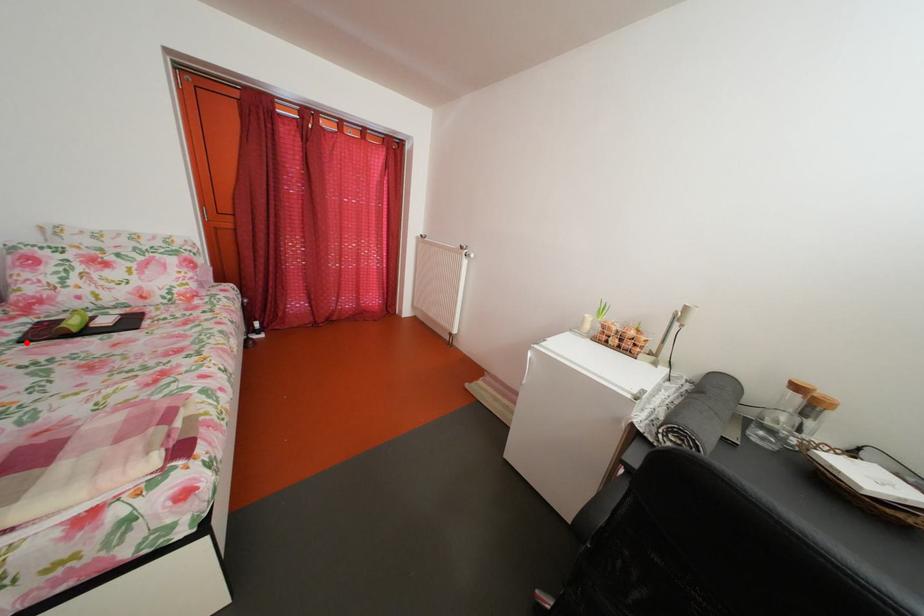
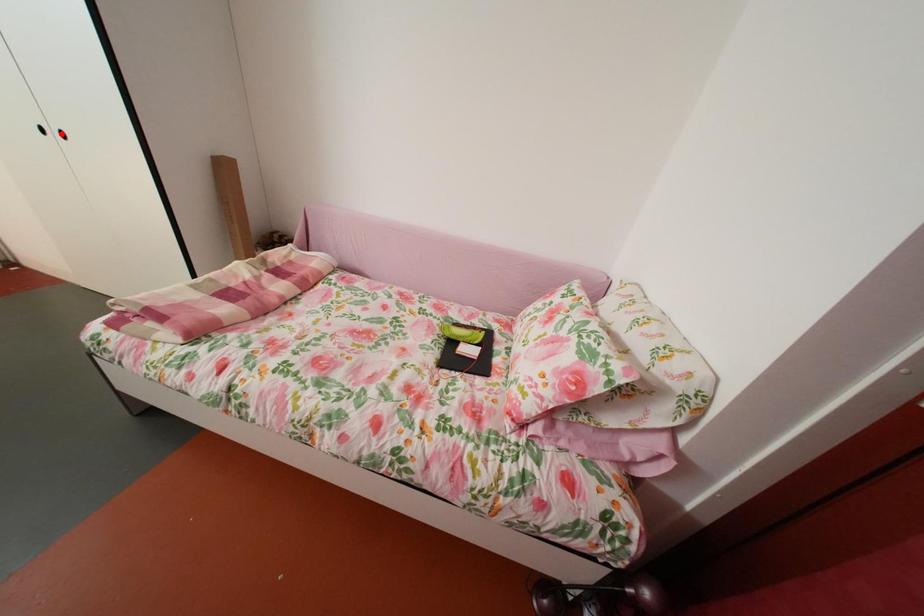
I am providing you with two images of the same scene from different viewpoints. A red point is marked on the first image and another point is marked on the second image. Do the highlighted points in image1 and image2 indicate the same real-world spot?

No